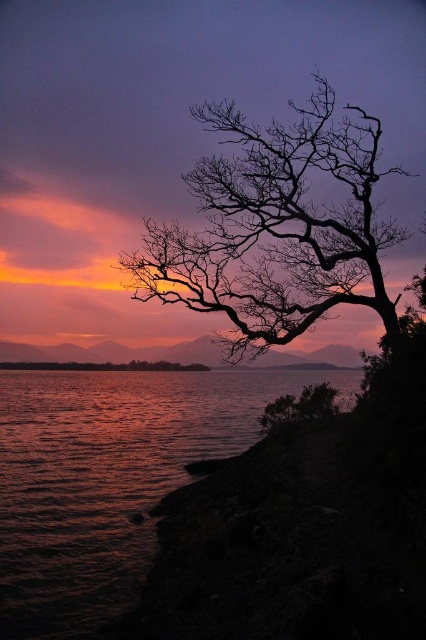
You are a photographer trying to capture the sunset scene. You notice two points in the image labeled as point (101, 497) and point (244, 129). Which point is closer to the camera?

Point (244, 129) is closer to the camera because point (101, 497) is behind it.

You are standing at the center of the image and want to reach the shiny metallic water at lower left located at point (108, 477). Which direction should you move in to get there?

You should move towards the lower left direction to reach the shiny metallic water at lower left located at point (108, 477).

You are an artist trying to paint the sunset scene. You need to place the shiny metallic water at lower left and the silhouette bark tree at upper right in your painting. Based on the scene description, which object should be placed to the left of the other?

The shiny metallic water at lower left should be placed to the left of the silhouette bark tree at upper right because the shiny metallic water at lower left is positioned on the left side of silhouette bark tree at upper right according to the description.